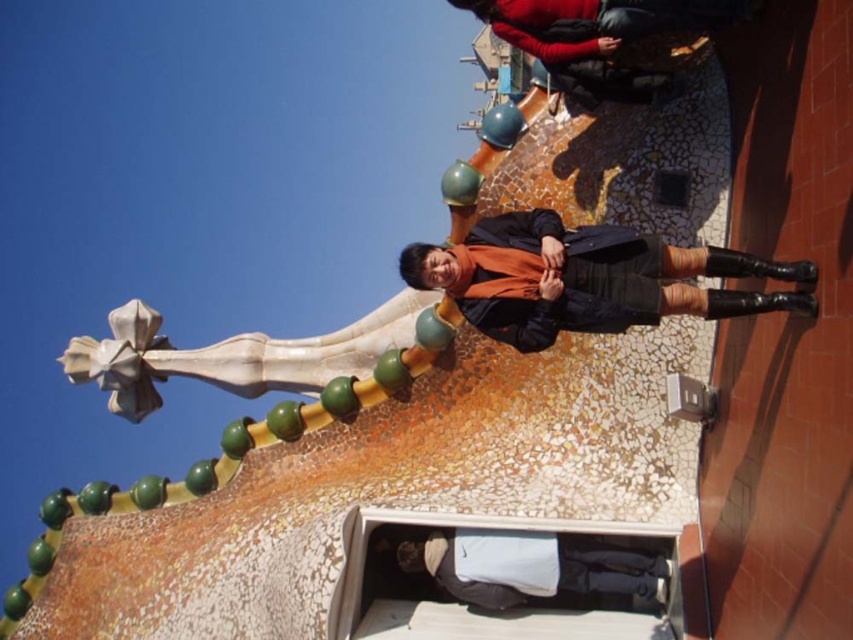
Question: Is matte black coat at center behind dark gray fabric pants at lower center?

Choices:
 (A) no
 (B) yes

Answer: (A)

Question: Does matte black coat at center appear on the left side of dark gray fabric pants at lower center?

Choices:
 (A) yes
 (B) no

Answer: (B)

Question: Which object appears closest to the camera in this image?

Choices:
 (A) dark gray fabric pants at lower center
 (B) matte black coat at center

Answer: (B)

Question: Among these objects, which one is nearest to the camera?

Choices:
 (A) matte black coat at center
 (B) dark gray fabric pants at lower center

Answer: (A)

Question: Can you confirm if matte black coat at center is positioned to the left of dark gray fabric pants at lower center?

Choices:
 (A) yes
 (B) no

Answer: (B)